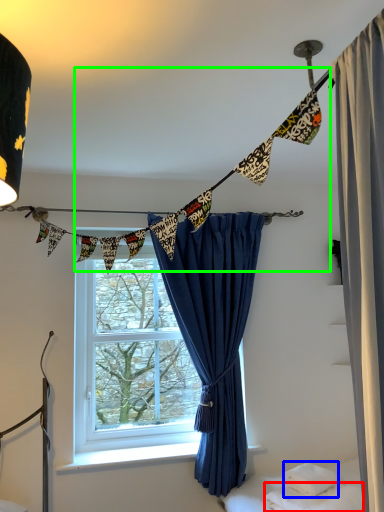
Question: Which object is the closest to the sheet (highlighted by a red box)? Choose among these: pillow (highlighted by a blue box) or clothesline (highlighted by a green box).

Choices:
 (A) pillow
 (B) clothesline

Answer: (A)